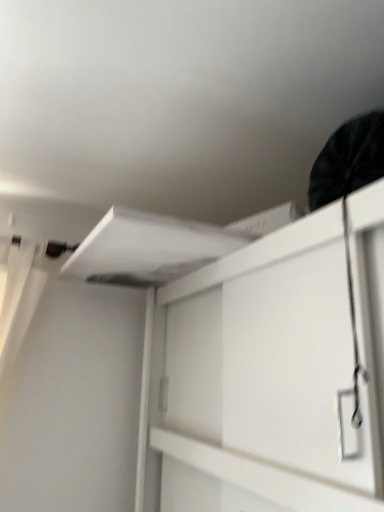
This screenshot has height=512, width=384. Find the location of `white matte exhaust hood at upper center`. white matte exhaust hood at upper center is located at coordinates coord(147,249).

The height and width of the screenshot is (512, 384). What do you see at coordinates (147, 249) in the screenshot?
I see `white matte exhaust hood at upper center` at bounding box center [147, 249].

At what (x,y) coordinates should I click in order to perform the action: click on white matte exhaust hood at upper center. Please return your answer as a coordinate pair (x, y). Looking at the image, I should click on (147, 249).